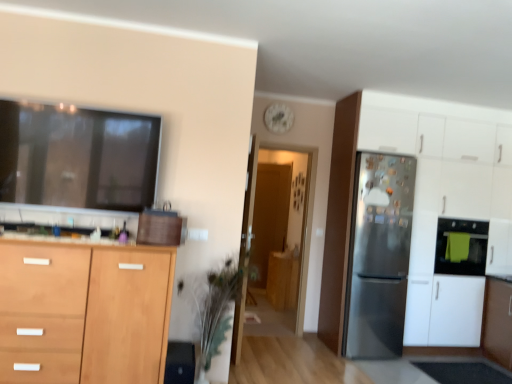
Where is `free spot in front of satin silver refrigerator at right`? free spot in front of satin silver refrigerator at right is located at coordinates (365, 362).